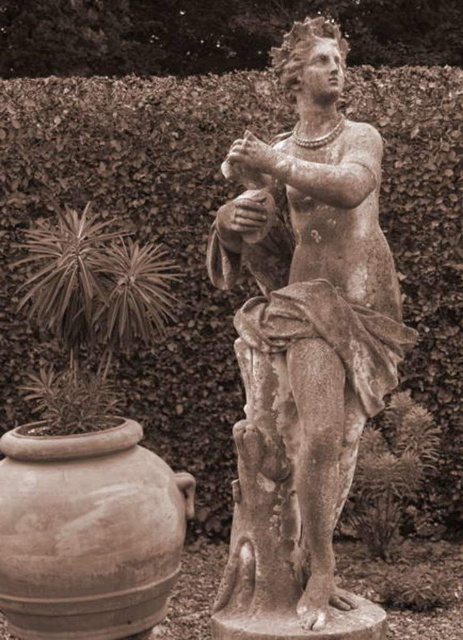
Question: Can you confirm if stone statue at center is wider than brown clay vase at lower left?

Choices:
 (A) no
 (B) yes

Answer: (A)

Question: Does stone statue at center have a smaller size compared to brown clay vase at lower left?

Choices:
 (A) no
 (B) yes

Answer: (A)

Question: Which point is farther from the camera taking this photo?

Choices:
 (A) (331, 24)
 (B) (139, 145)

Answer: (B)

Question: Based on their relative distances, which object is nearer to the stone statue at center?

Choices:
 (A) brown clay vase at lower left
 (B) green leafy hedge at upper center

Answer: (A)

Question: Can you confirm if green leafy hedge at upper center is positioned above stone statue at center?

Choices:
 (A) yes
 (B) no

Answer: (A)

Question: Based on their relative distances, which object is farther from the brown clay vase at lower left?

Choices:
 (A) green leafy hedge at upper center
 (B) stone statue at center

Answer: (A)